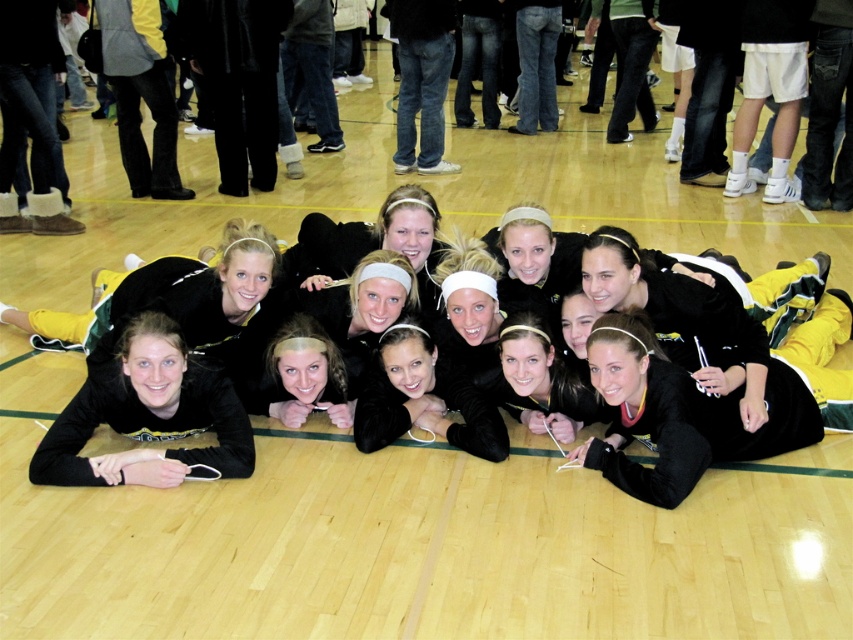
Question: Can you confirm if black matte headband at center is positioned to the right of matte black headband at center?

Choices:
 (A) yes
 (B) no

Answer: (A)

Question: Which point appears closest to the camera in this image?

Choices:
 (A) (207, 468)
 (B) (247, 316)

Answer: (A)

Question: Can you confirm if black matte headband at center is positioned to the right of matte black headband at center?

Choices:
 (A) yes
 (B) no

Answer: (A)

Question: Which of the following is the closest to the observer?

Choices:
 (A) black matte headband at center
 (B) matte black headband at center

Answer: (A)

Question: Does black matte headband at center have a smaller size compared to matte black headband at center?

Choices:
 (A) yes
 (B) no

Answer: (A)